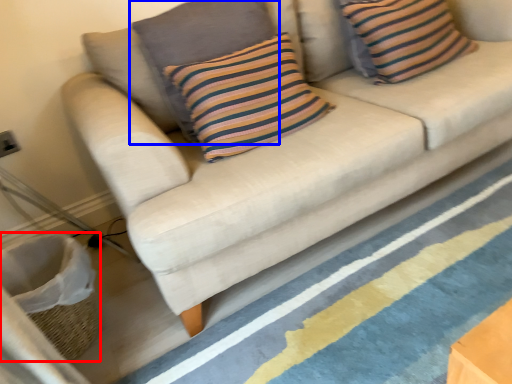
Question: Which of the following is the farthest to the observer, basket (highlighted by a red box) or pillow (highlighted by a blue box)?

Choices:
 (A) basket
 (B) pillow

Answer: (B)